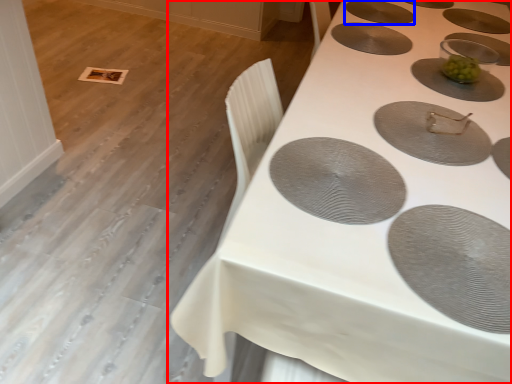
Question: Which point is further to the camera, table (highlighted by a red box) or oval (highlighted by a blue box)?

Choices:
 (A) table
 (B) oval

Answer: (B)